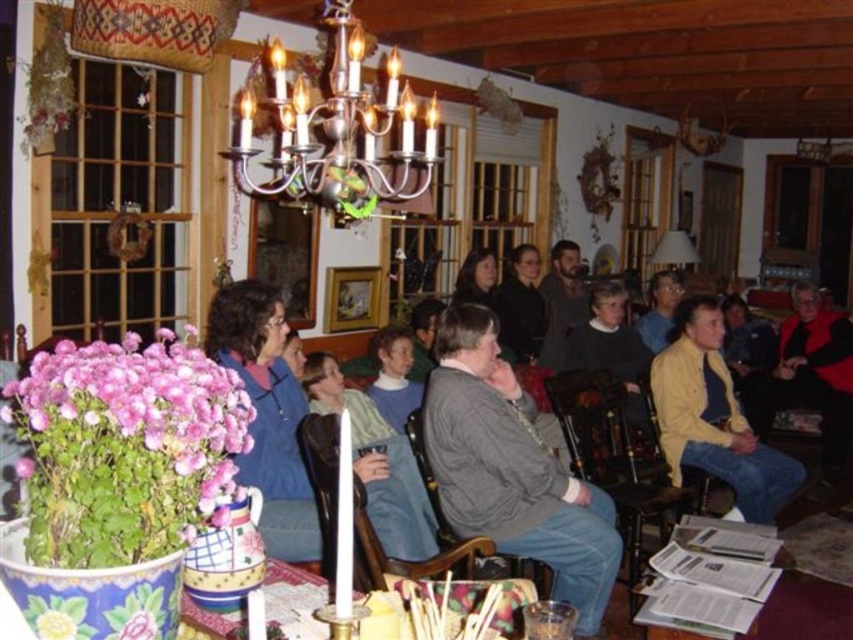
Question: Which object is closer to the camera taking this photo?

Choices:
 (A) matte blue sweater at center
 (B) gray wool sweater at center
 (C) porcelain vase at center

Answer: (C)

Question: In this image, where is silver/metallic chandelier at upper center located relative to matte blue sweater at center?

Choices:
 (A) above
 (B) below

Answer: (A)

Question: Is pink fabric flower at lower left to the left of silver/metallic chandelier at upper center from the viewer's perspective?

Choices:
 (A) yes
 (B) no

Answer: (A)

Question: Which point is closer to the camera?

Choices:
 (A) porcelain vase at center
 (B) silver/metallic chandelier at upper center

Answer: (A)

Question: Which of the following is the closest to the observer?

Choices:
 (A) porcelain vase at center
 (B) gray wool sweater at center

Answer: (A)

Question: Is pink fabric flower at lower left to the right of porcelain vase at center from the viewer's perspective?

Choices:
 (A) yes
 (B) no

Answer: (B)